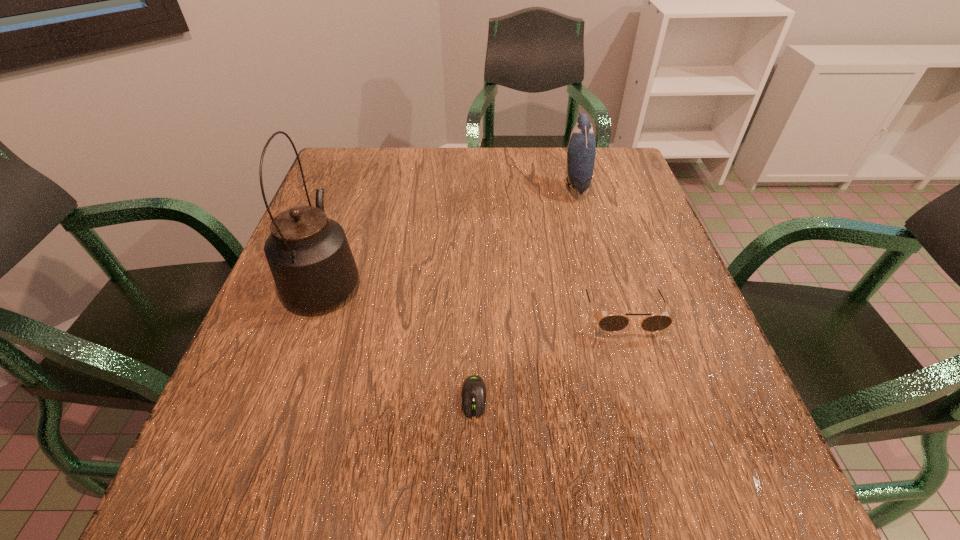
At what (x,y) coordinates should I click in order to perform the action: click on vacant space situated 0.320m at the tip of the bird's beak. Please return your answer as a coordinate pair (x, y). The height and width of the screenshot is (540, 960). Looking at the image, I should click on (450, 185).

This screenshot has height=540, width=960. I want to click on free space located 0.190m at the tip of the bird's beak, so click(x=495, y=185).

This screenshot has height=540, width=960. Identify the location of free spot located at the tip of the bird's beak. (x=486, y=185).

Where is `free space located on the front lenses of the third tallest object`? free space located on the front lenses of the third tallest object is located at coordinates (641, 379).

The height and width of the screenshot is (540, 960). I want to click on free spot located 0.080m on the wheel side of the shortest object, so click(x=473, y=467).

Locate an element on the screen. The width and height of the screenshot is (960, 540). object situated at the far edge is located at coordinates (581, 150).

Identify the location of object that is at the left edge. This screenshot has width=960, height=540. (309, 256).

Where is `bird that is positioned at the right edge`? This screenshot has height=540, width=960. bird that is positioned at the right edge is located at coordinates (581, 150).

Where is `sunglasses that is at the right edge`? This screenshot has height=540, width=960. sunglasses that is at the right edge is located at coordinates (612, 323).

The height and width of the screenshot is (540, 960). What are the coordinates of `object that is at the far right corner` in the screenshot? It's located at (581, 150).